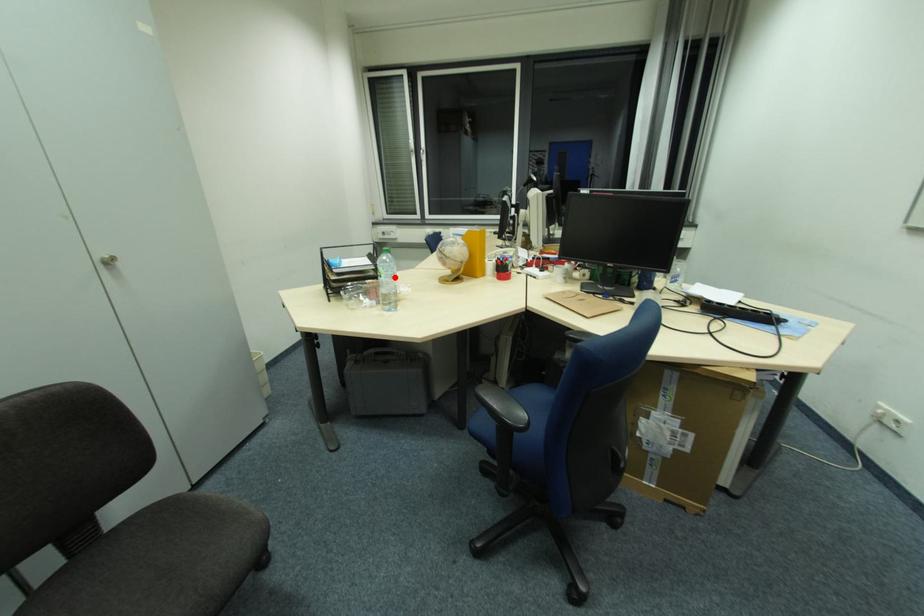
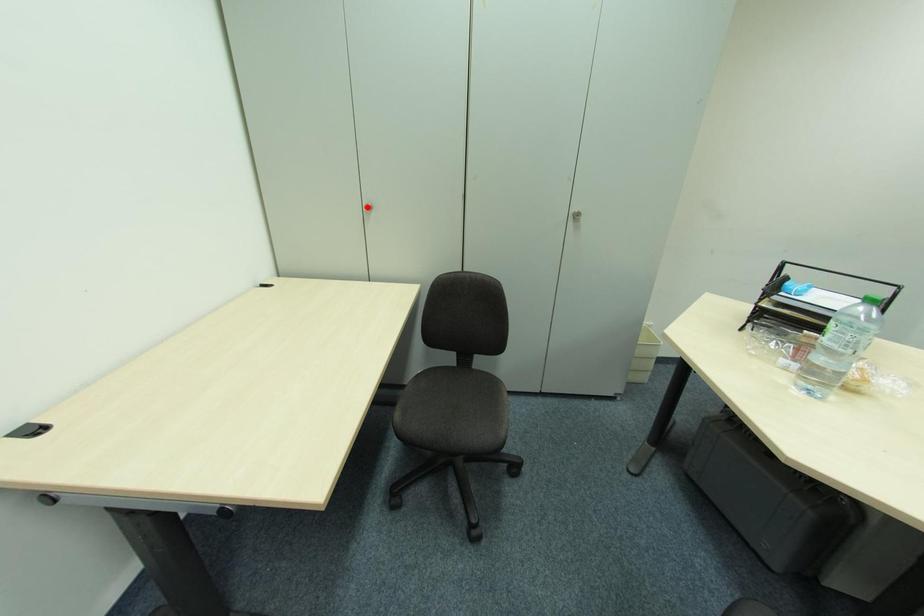
I am providing you with two images of the same scene from different viewpoints. A red point is marked on the first image and another point is marked on the second image. Is the red point in image1 aligned with the point shown in image2?

No